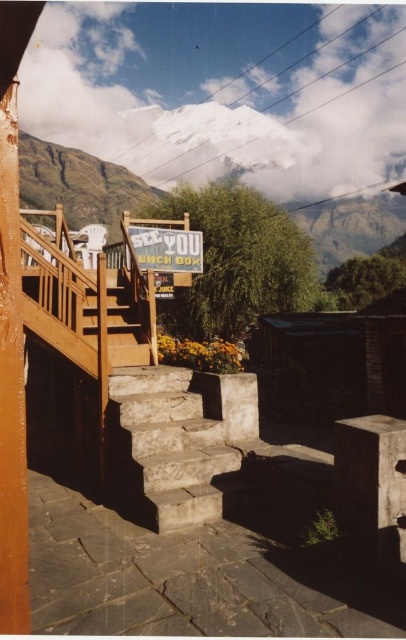
You are a delivery person carrying a large package that is 6 feet wide. You need to navigate through the space between the stone textured stairs at center and wooden stairs at center. Can your package fit through the space between them?

The stone textured stairs at center and wooden stairs at center are 6.08 feet apart. Since the package is 6 feet wide, it can fit through the space between them as the distance is slightly larger than the package width.

You are standing at the bottom of the stairs and want to reach the wooden deck above. The stone textured stairs at center and wooden stairs at center are both leading upwards. Which set of stairs should you take to reach the deck first?

The stone textured stairs at center is in front of wooden stairs at center, so taking the stone textured stairs at center will allow you to reach the deck first since they are closer to your starting position.

You are standing at the bottom of the stone textured stairs at center and want to reach the wooden deck area. There is a point marked at coordinates [164,449]. Is this point located on the stairs or the wooden deck?

The point at coordinates [164,449] is on the stone textured stairs at center, so it is not on the wooden deck.